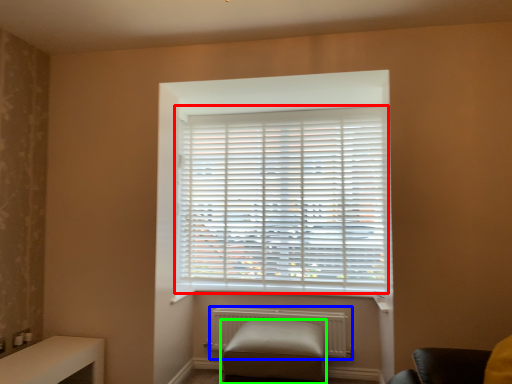
Question: Which object is the farthest from window blind (highlighted by a red box)? Choose among these: radiator (highlighted by a blue box) or furniture (highlighted by a green box).

Choices:
 (A) radiator
 (B) furniture

Answer: (B)